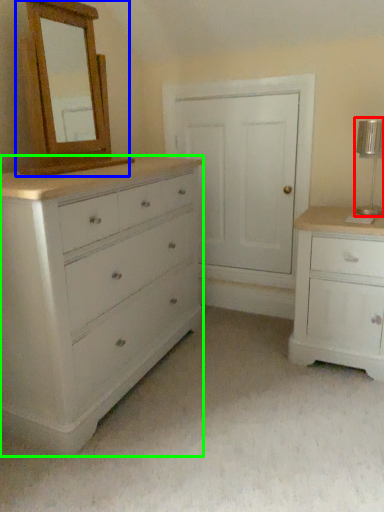
Question: Estimate the real-world distances between objects in this image. Which object is farther from table lamp (highlighted by a red box), medicine cabinet (highlighted by a blue box) or chest of drawers (highlighted by a green box)?

Choices:
 (A) medicine cabinet
 (B) chest of drawers

Answer: (A)